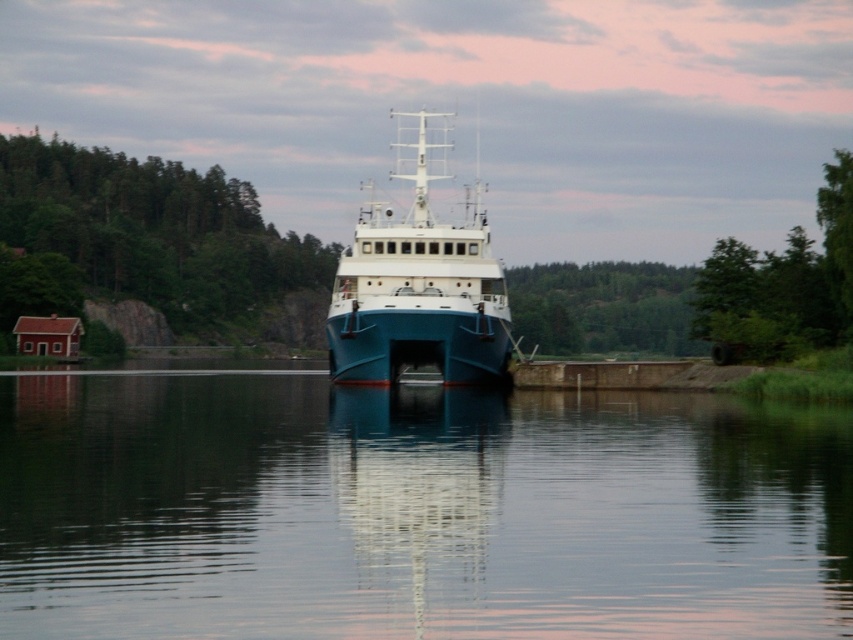
You are standing on the dock and looking at the smooth water at center and the blue matte boat at center. Which object is positioned lower in the image?

The smooth water at center is located below the blue matte boat at center, so it is positioned lower in the image.

You are standing on the ferry and looking at two points marked on the deck. The first point is at coordinates point (88, 600) and the second is at point (397, 276). Which point is closer to you?

Point (88, 600) is closer to the viewer than point (397, 276).

Looking at this image, you are standing on the dock and looking at the smooth water at center and the blue matte boat at center. Which object is positioned to the right side?

The smooth water at center is to the right of the blue matte boat at center, so the smooth water at center is positioned to the right side.